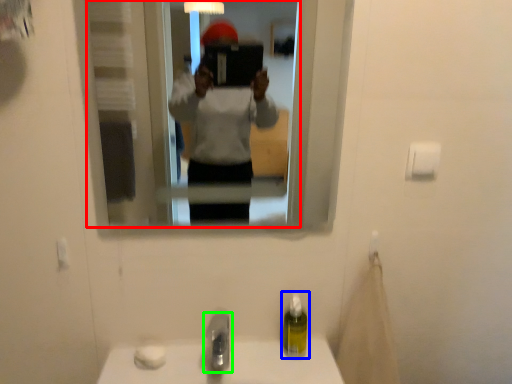
Question: Considering the real-world distances, which object is closest to mirror (highlighted by a red box)? soap dispenser (highlighted by a blue box) or tap (highlighted by a green box).

Choices:
 (A) soap dispenser
 (B) tap

Answer: (B)